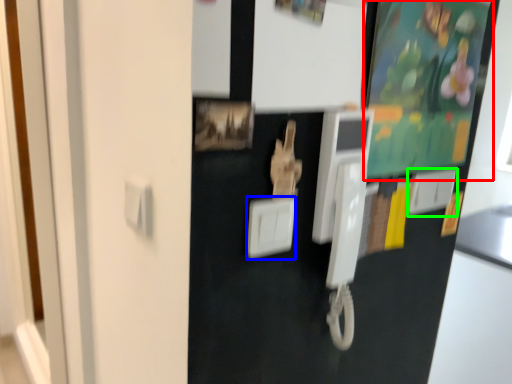
Question: Which object is the closest to the bulletin board (highlighted by a red box)? Choose among these: light switch (highlighted by a blue box) or light switch (highlighted by a green box).

Choices:
 (A) light switch
 (B) light switch

Answer: (B)